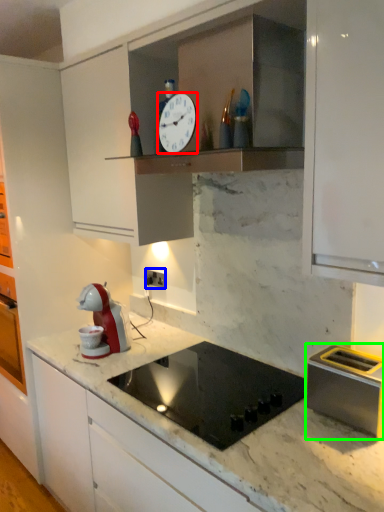
Question: Based on their relative distances, which object is farther from clock (highlighted by a red box)? Choose from electric outlet (highlighted by a blue box) and kitchen appliance (highlighted by a green box).

Choices:
 (A) electric outlet
 (B) kitchen appliance

Answer: (A)